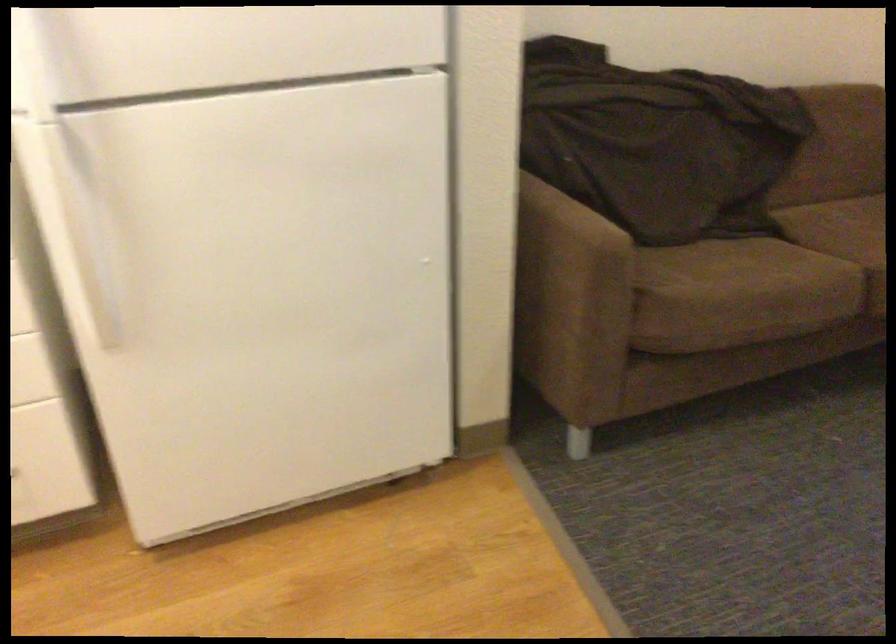
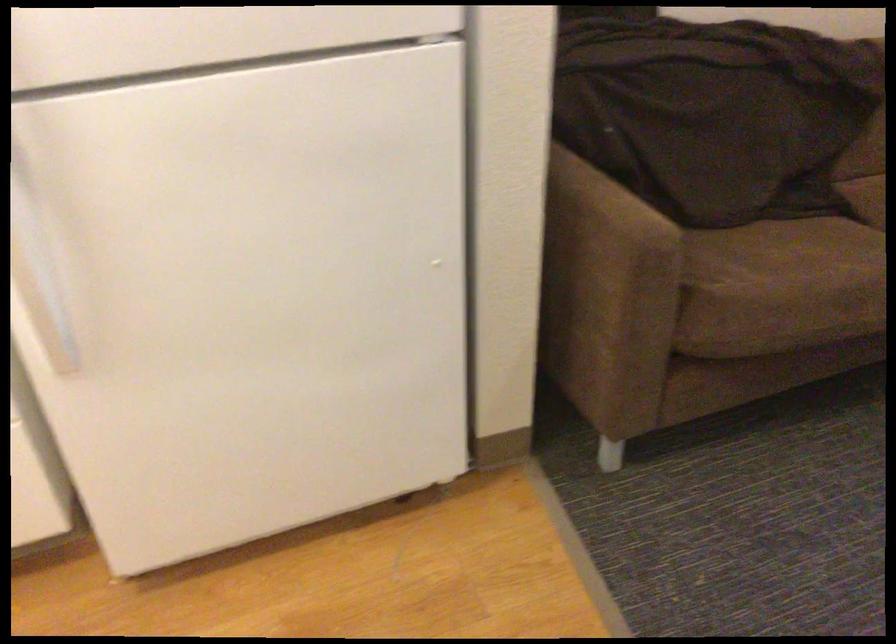
Question: In a continuous first-person perspective shot, in which direction is the camera moving?

Choices:
 (A) Left
 (B) Right
 (C) Forward
 (D) Backward

Answer: (C)